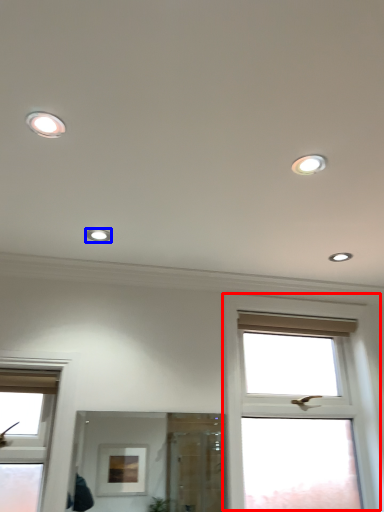
Question: Among these objects, which one is farthest to the camera, window (highlighted by a red box) or dot (highlighted by a blue box)?

Choices:
 (A) window
 (B) dot

Answer: (A)